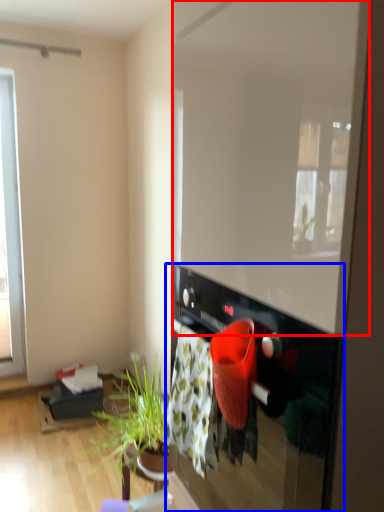
Question: Which point is further to the camera, window screen (highlighted by a red box) or oven (highlighted by a blue box)?

Choices:
 (A) window screen
 (B) oven

Answer: (B)